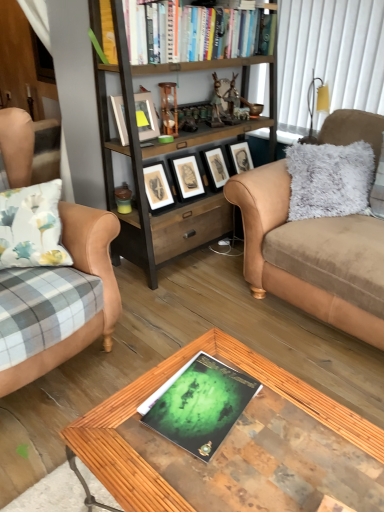
Where is `vacant space to the right of tan leather couch at left, which is counted as the 1th studio couch, starting from the left`? The height and width of the screenshot is (512, 384). vacant space to the right of tan leather couch at left, which is counted as the 1th studio couch, starting from the left is located at coordinates (192, 310).